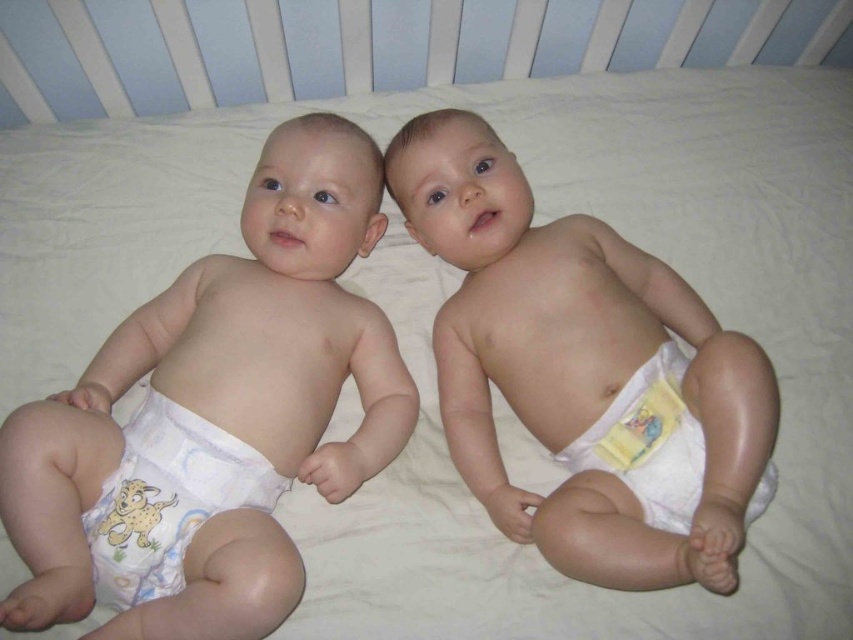
Can you confirm if white cloth diaper at center is wider than white printed diaper at lower left?

Yes.

Between white cloth diaper at center and white printed diaper at lower left, which one has more height?

With more height is white cloth diaper at center.

The height and width of the screenshot is (640, 853). In order to click on white cloth diaper at center in this screenshot , I will do `click(585, 372)`.

Locate an element on the screen. The height and width of the screenshot is (640, 853). white cloth diaper at center is located at coordinates (585, 372).

Is point (602, 515) closer to camera compared to point (663, 513)?

That is True.

How much distance is there between white cloth diaper at center and white soft diaper at lower right?

white cloth diaper at center is 4.41 inches away from white soft diaper at lower right.

I want to click on white cloth diaper at center, so click(x=585, y=372).

Where is `white cloth diaper at center`? The height and width of the screenshot is (640, 853). white cloth diaper at center is located at coordinates (585, 372).

Does white printed diaper at lower left appear on the left side of white soft diaper at lower right?

Indeed, white printed diaper at lower left is positioned on the left side of white soft diaper at lower right.

Which is behind, point (144, 580) or point (635, 412)?

The point (635, 412) is more distant.

The width and height of the screenshot is (853, 640). I want to click on white printed diaper at lower left, so click(167, 499).

Where is `white printed diaper at lower left`? This screenshot has width=853, height=640. white printed diaper at lower left is located at coordinates (167, 499).